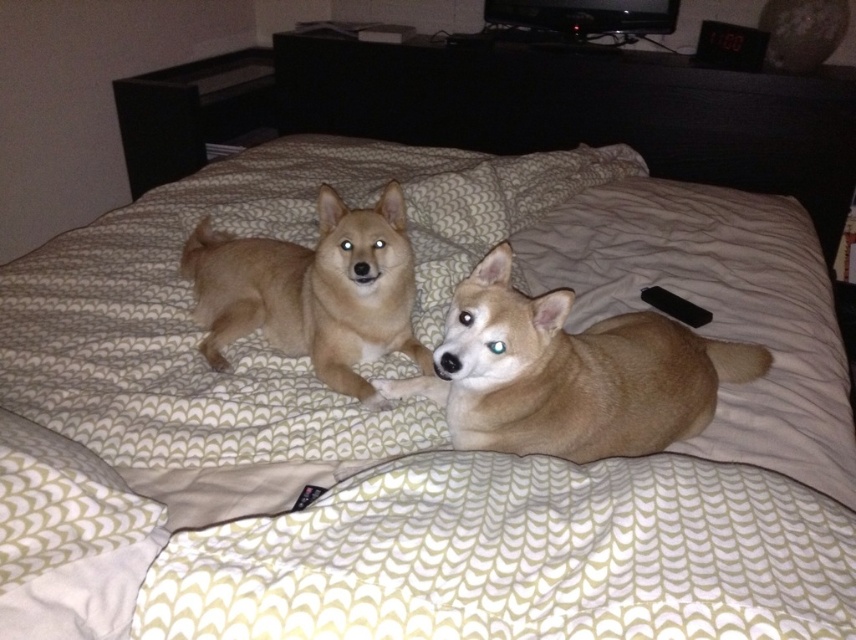
Does fuzzy beige dog at center appear on the left side of sandy fur dog at center?

No, fuzzy beige dog at center is not to the left of sandy fur dog at center.

Does point (516, 348) lie in front of point (288, 342)?

Yes, point (516, 348) is closer to viewer.

I want to click on fuzzy beige dog at center, so click(x=569, y=372).